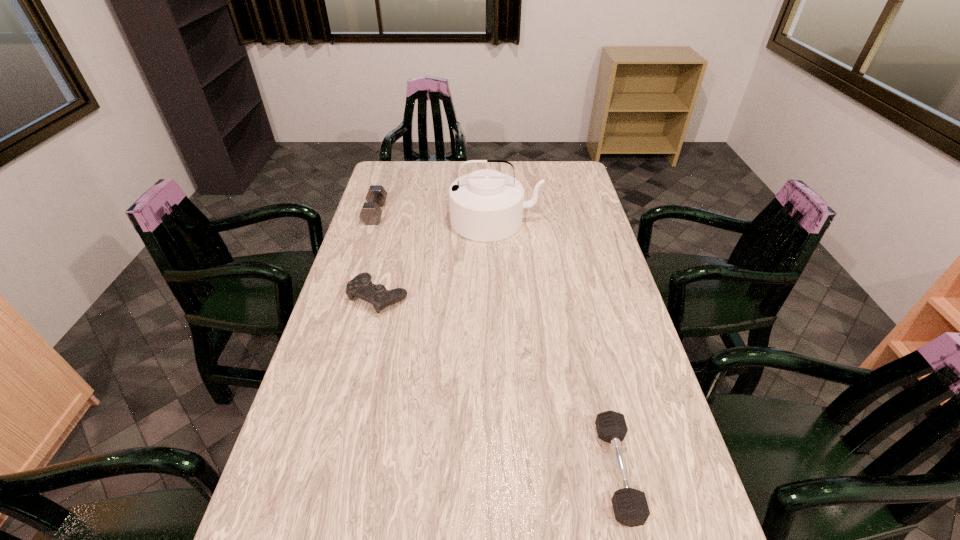
Where is `unoccupied area between the third object from left to right and the left dumbbell`? unoccupied area between the third object from left to right and the left dumbbell is located at coordinates (435, 217).

Image resolution: width=960 pixels, height=540 pixels. Find the location of `blank region between the third farthest object and the farther dumbbell`. blank region between the third farthest object and the farther dumbbell is located at coordinates (377, 255).

Locate an element on the screen. This screenshot has height=540, width=960. empty location between the third object from left to right and the control is located at coordinates (437, 259).

Locate an element on the screen. free area in between the rightmost object and the tallest object is located at coordinates (556, 346).

I want to click on vacant point located between the farther dumbbell and the third object from left to right, so (x=435, y=217).

Locate an element on the screen. free space between the second nearest object and the right dumbbell is located at coordinates (498, 384).

This screenshot has height=540, width=960. Find the location of `object that can be found as the second closest to the second object from right to left`. object that can be found as the second closest to the second object from right to left is located at coordinates (371, 212).

Identify the location of object that is the second closest to the farther dumbbell. (361, 286).

Locate an element on the screen. Image resolution: width=960 pixels, height=540 pixels. blank area in the image that satisfies the following two spatial constraints: 1. on the front side of the control; 2. on the right side of the farther dumbbell is located at coordinates (349, 296).

At what (x,y) coordinates should I click in order to perform the action: click on free spot that satisfies the following two spatial constraints: 1. on the spout of the tallest object; 2. on the left side of the shorter dumbbell. Please return your answer as a coordinate pair (x, y). The image size is (960, 540). Looking at the image, I should click on (506, 471).